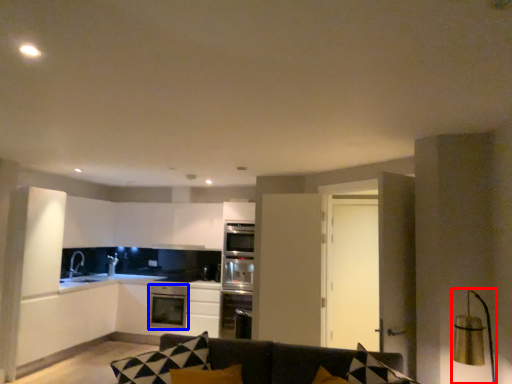
Question: Which point is further to the camera, light fixture (highlighted by a red box) or dish washer (highlighted by a blue box)?

Choices:
 (A) light fixture
 (B) dish washer

Answer: (B)